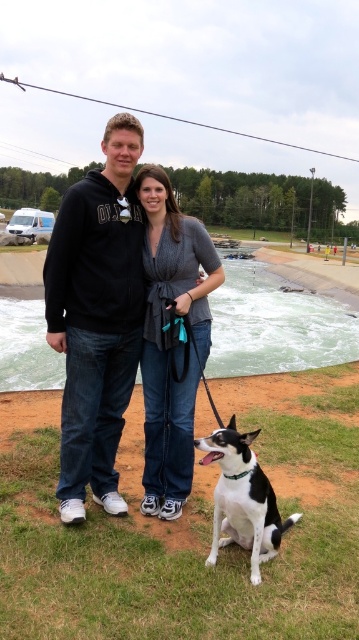
Question: Which object appears farthest from the camera in this image?

Choices:
 (A) black and white fur at lower center
 (B) black hoodie at center
 (C) denim jeans at center

Answer: (C)

Question: Considering the relative positions of denim jeans at center and black and white fur at lower center in the image provided, where is denim jeans at center located with respect to black and white fur at lower center?

Choices:
 (A) above
 (B) below

Answer: (A)

Question: Which object is the farthest from the denim jeans at center?

Choices:
 (A) black and white fur at lower center
 (B) black hoodie at center

Answer: (A)

Question: Does black hoodie at center have a lesser width compared to black and white fur at lower center?

Choices:
 (A) yes
 (B) no

Answer: (B)

Question: Does denim jeans at center have a greater width compared to black hoodie at center?

Choices:
 (A) yes
 (B) no

Answer: (B)

Question: Which of the following is the closest to the observer?

Choices:
 (A) black and white fur at lower center
 (B) denim jeans at center
 (C) black hoodie at center

Answer: (A)